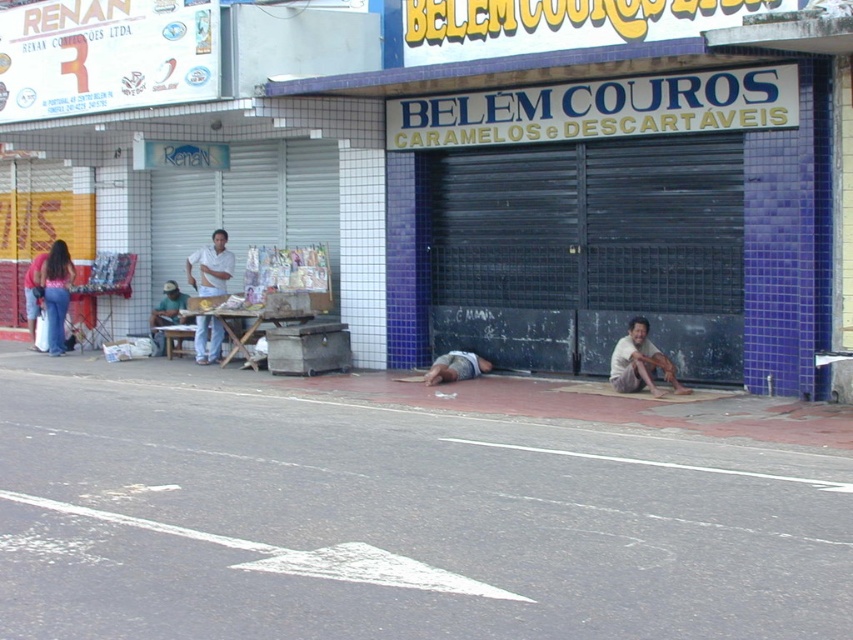
Can you confirm if blue tile storefront at center is positioned below white shirt at center?

Actually, blue tile storefront at center is above white shirt at center.

Identify the location of blue tile storefront at center. The height and width of the screenshot is (640, 853). (479, 164).

Which is in front, point (740, 202) or point (158, 321)?

Point (740, 202)

Who is positioned more to the left, black metal/gate at center or light brown wooden table at center-left?

light brown wooden table at center-left is more to the left.

Locate an element on the screen. The width and height of the screenshot is (853, 640). black metal/gate at center is located at coordinates (585, 252).

Who is more distant from viewer, (157, 337) or (33, 337)?

Result: The point (33, 337) is more distant.

What are the coordinates of `light brown wooden table at center-left` in the screenshot? It's located at (165, 314).

Who is more distant from viewer, (183, 308) or (32, 346)?

Point (32, 346)

Where is `light brown wooden table at center-left`? The height and width of the screenshot is (640, 853). light brown wooden table at center-left is located at coordinates (165, 314).